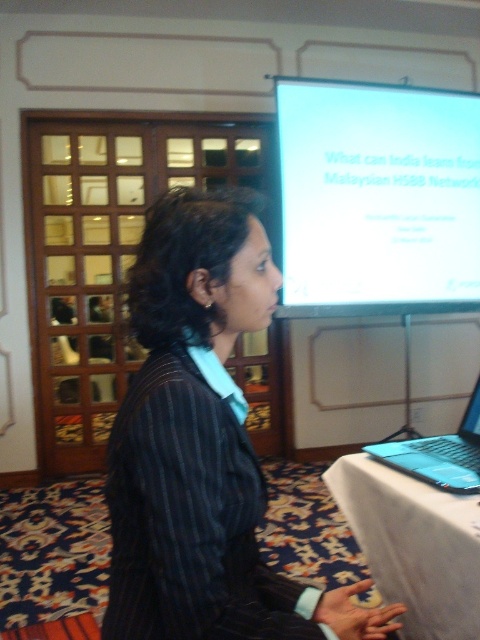
Question: Which object appears farthest from the camera in this image?

Choices:
 (A) white cloth at lower right
 (B) dark pinstripe blazer at center
 (C) blue plastic laptop at lower right
 (D) white matte projection screen at upper center

Answer: (D)

Question: Which point appears closest to the camera in this image?

Choices:
 (A) (148, 364)
 (B) (408, 449)
 (C) (376, 540)

Answer: (A)

Question: Which point appears closest to the camera in this image?

Choices:
 (A) (446, 476)
 (B) (252, 579)

Answer: (B)

Question: In this image, where is dark pinstripe blazer at center located relative to white matte projection screen at upper center?

Choices:
 (A) below
 (B) above

Answer: (A)

Question: Does dark pinstripe blazer at center appear over white cloth at lower right?

Choices:
 (A) no
 (B) yes

Answer: (B)

Question: Does dark pinstripe blazer at center have a lesser width compared to blue plastic laptop at lower right?

Choices:
 (A) no
 (B) yes

Answer: (A)